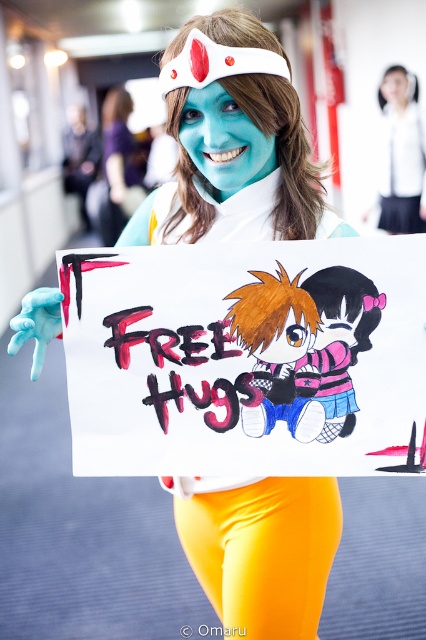
Does pastel pink fabric plush at center appear on the left side of matte white headband at upper center?

Answer: Yes, pastel pink fabric plush at center is to the left of matte white headband at upper center.

This screenshot has width=426, height=640. I want to click on pastel pink fabric plush at center, so click(305, 348).

At what (x,y) coordinates should I click in order to perform the action: click on pastel pink fabric plush at center. Please return your answer as a coordinate pair (x, y). Looking at the image, I should click on (305, 348).

Between blue matte face at center and white fabric shirt at upper center, which one has more height?

With more height is white fabric shirt at upper center.

Can you confirm if blue matte face at center is shorter than white fabric shirt at upper center?

Yes.

Image resolution: width=426 pixels, height=640 pixels. What do you see at coordinates (224, 141) in the screenshot?
I see `blue matte face at center` at bounding box center [224, 141].

The image size is (426, 640). I want to click on blue matte face at center, so click(x=224, y=141).

Can you confirm if blue matte face at center is thinner than matte blue face paint at center?

Indeed, blue matte face at center has a lesser width compared to matte blue face paint at center.

Is blue matte face at center in front of matte blue face paint at center?

Yes, it is in front of matte blue face paint at center.

Find the location of a particular element. The height and width of the screenshot is (640, 426). blue matte face at center is located at coordinates (224, 141).